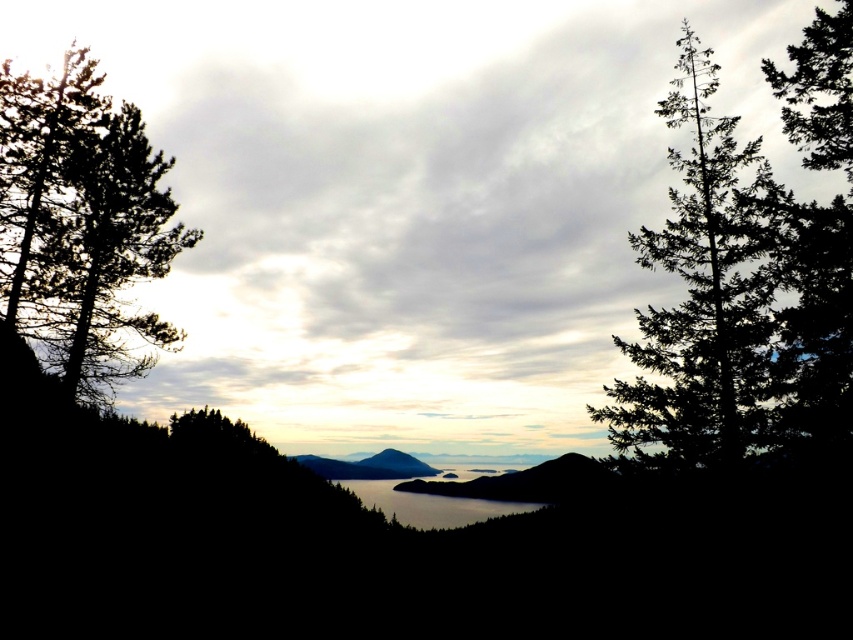
You are an artist trying to paint this landscape. You want to ensure the cloudy sky at center and the green textured tree at right are placed correctly according to their positions in the image. Which object should be drawn first to maintain their spatial relationship?

The cloudy sky at center should be drawn first because it is positioned on the left side of the green textured tree at right, so starting with the sky allows the tree to be placed to its right afterward.

You are an observer standing in the middle of the scene. You see the cloudy sky at center and the clear water at center. Which object is located to the right of the other?

The cloudy sky at center is to the right of clear water at center.